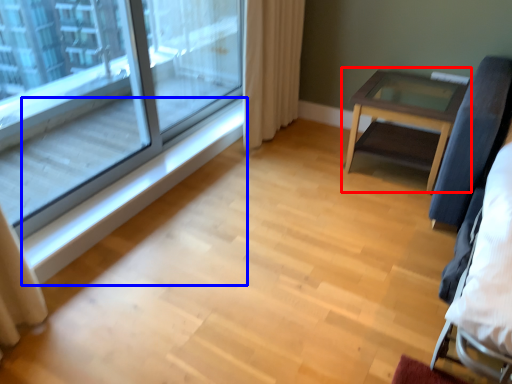
Question: Which object appears farthest to the camera in this image, table (highlighted by a red box) or window sill (highlighted by a blue box)?

Choices:
 (A) table
 (B) window sill

Answer: (A)